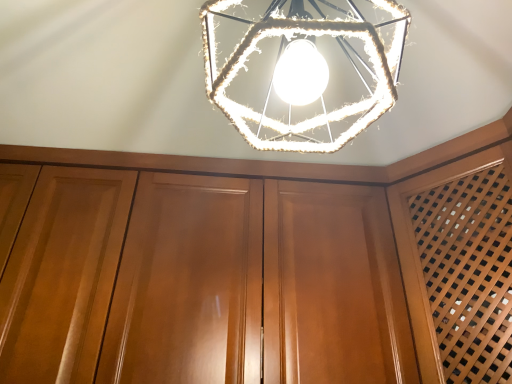
Image resolution: width=512 pixels, height=384 pixels. Describe the element at coordinates (306, 71) in the screenshot. I see `rope-wrapped hexagonal light at center` at that location.

Locate an element on the screen. This screenshot has height=384, width=512. rope-wrapped hexagonal light at center is located at coordinates (306, 71).

This screenshot has width=512, height=384. What do you see at coordinates (244, 272) in the screenshot? I see `glossy wood dresser at center` at bounding box center [244, 272].

Where is `glossy wood dresser at center`? Image resolution: width=512 pixels, height=384 pixels. glossy wood dresser at center is located at coordinates tap(244, 272).

At what (x,y) coordinates should I click in order to perform the action: click on rope-wrapped hexagonal light at center. Please return your answer as a coordinate pair (x, y). Image resolution: width=512 pixels, height=384 pixels. Looking at the image, I should click on (306, 71).

Which is more to the left, glossy wood dresser at center or rope-wrapped hexagonal light at center?

Positioned to the left is glossy wood dresser at center.

Between glossy wood dresser at center and rope-wrapped hexagonal light at center, which one is positioned in front?

rope-wrapped hexagonal light at center.

Which point is more distant from viewer, (200,231) or (308,26)?

Point (200,231)

From the image's perspective, between glossy wood dresser at center and rope-wrapped hexagonal light at center, who is located below?

glossy wood dresser at center appears lower in the image.

From a real-world perspective, who is located lower, glossy wood dresser at center or rope-wrapped hexagonal light at center?

In real-world perspective, glossy wood dresser at center is lower.

Considering the sizes of objects glossy wood dresser at center and rope-wrapped hexagonal light at center in the image provided, who is thinner, glossy wood dresser at center or rope-wrapped hexagonal light at center?

Thinner between the two is rope-wrapped hexagonal light at center.

Which of these two, glossy wood dresser at center or rope-wrapped hexagonal light at center, stands shorter?

With less height is rope-wrapped hexagonal light at center.

Consider the image. Can you confirm if glossy wood dresser at center is bigger than rope-wrapped hexagonal light at center?

Yes.

Can we say glossy wood dresser at center lies outside rope-wrapped hexagonal light at center?

Absolutely, glossy wood dresser at center is external to rope-wrapped hexagonal light at center.

Is glossy wood dresser at center beside rope-wrapped hexagonal light at center?

No, glossy wood dresser at center is not beside rope-wrapped hexagonal light at center.

Is glossy wood dresser at center turned away from rope-wrapped hexagonal light at center?

No.

This screenshot has width=512, height=384. Find the location of `dresser behind the rope-wrapped hexagonal light at center`. dresser behind the rope-wrapped hexagonal light at center is located at coordinates (244, 272).

Considering the relative positions of rope-wrapped hexagonal light at center and glossy wood dresser at center in the image provided, is rope-wrapped hexagonal light at center to the right of glossy wood dresser at center from the viewer's perspective?

Correct, you'll find rope-wrapped hexagonal light at center to the right of glossy wood dresser at center.

In the scene shown: Is rope-wrapped hexagonal light at center positioned behind glossy wood dresser at center?

No, it is not.

Is point (390, 87) behind point (19, 347)?

No, (390, 87) is in front of (19, 347).

From the image's perspective, is rope-wrapped hexagonal light at center under glossy wood dresser at center?

No, from the image's perspective, rope-wrapped hexagonal light at center is not below glossy wood dresser at center.

In the scene shown: From a real-world perspective, does rope-wrapped hexagonal light at center sit lower than glossy wood dresser at center?

No.

Between rope-wrapped hexagonal light at center and glossy wood dresser at center, which one has smaller width?

Thinner between the two is rope-wrapped hexagonal light at center.

Considering the sizes of rope-wrapped hexagonal light at center and glossy wood dresser at center in the image, is rope-wrapped hexagonal light at center taller or shorter than glossy wood dresser at center?

Clearly, rope-wrapped hexagonal light at center is shorter compared to glossy wood dresser at center.

Which of these two, rope-wrapped hexagonal light at center or glossy wood dresser at center, is bigger?

Bigger between the two is glossy wood dresser at center.

Is rope-wrapped hexagonal light at center completely or partially outside of glossy wood dresser at center?

Yes, rope-wrapped hexagonal light at center is outside of glossy wood dresser at center.

Is rope-wrapped hexagonal light at center directly adjacent to glossy wood dresser at center?

rope-wrapped hexagonal light at center is not next to glossy wood dresser at center, and they're not touching.

Could you tell me if rope-wrapped hexagonal light at center is facing glossy wood dresser at center?

No, rope-wrapped hexagonal light at center is not aimed at glossy wood dresser at center.

How far apart are rope-wrapped hexagonal light at center and glossy wood dresser at center?

The distance of rope-wrapped hexagonal light at center from glossy wood dresser at center is 21.14 inches.

You are a GUI agent. You are given a task and a screenshot of the screen. Output one action in this format:
    pyautogui.click(x=<x>, y=<y>)
    Task: Click on the lamp in front of the glossy wood dresser at center
    Image resolution: width=512 pixels, height=384 pixels.
    Given the screenshot: What is the action you would take?
    pyautogui.click(x=306, y=71)

Identify the location of lamp located above the glossy wood dresser at center (from a real-world perspective). The height and width of the screenshot is (384, 512). (306, 71).

You are a GUI agent. You are given a task and a screenshot of the screen. Output one action in this format:
    pyautogui.click(x=<x>, y=<y>)
    Task: Click on the lamp on the right of glossy wood dresser at center
    The image size is (512, 384).
    Given the screenshot: What is the action you would take?
    pyautogui.click(x=306, y=71)